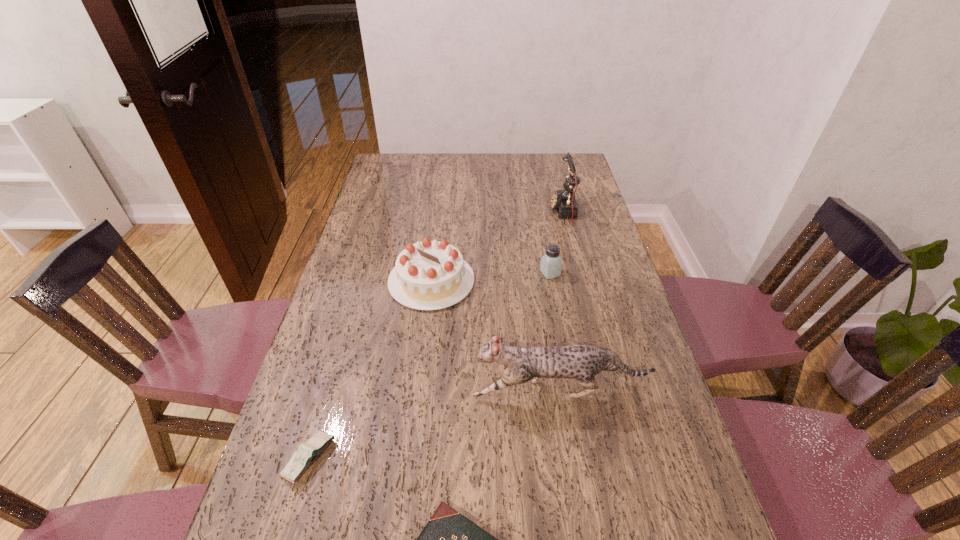
In the image, there is a desktop. Identify the location of vacant space at the left edge. (369, 285).

In the image, there is a desktop. Where is `vacant region at the right edge`? This screenshot has width=960, height=540. vacant region at the right edge is located at coordinates (569, 219).

In the image, there is a desktop. What are the coordinates of `vacant space at the far left corner` in the screenshot? It's located at (380, 161).

I want to click on vacant area at the far right corner, so click(x=549, y=159).

Find the location of a particular element. free space between the birthday cake and the fifth farthest object is located at coordinates (x=371, y=370).

The width and height of the screenshot is (960, 540). I want to click on free space between the second nearest object and the farthest object, so click(437, 335).

This screenshot has height=540, width=960. I want to click on unoccupied area between the third nearest object and the saltshaker, so click(555, 332).

You are a GUI agent. You are given a task and a screenshot of the screen. Output one action in this format:
    pyautogui.click(x=<x>, y=<y>)
    Task: Click on the vacant region between the telephone and the cat
    This screenshot has width=960, height=540.
    Given the screenshot: What is the action you would take?
    pyautogui.click(x=561, y=301)

Find the location of a particular element. free point between the cat and the third shortest object is located at coordinates (555, 332).

You are a GUI agent. You are given a task and a screenshot of the screen. Output one action in this format:
    pyautogui.click(x=<x>, y=<y>)
    Task: Click on the vacant point located between the fourth tallest object and the farthest object
    This screenshot has height=540, width=960.
    Given the screenshot: What is the action you would take?
    pyautogui.click(x=557, y=242)